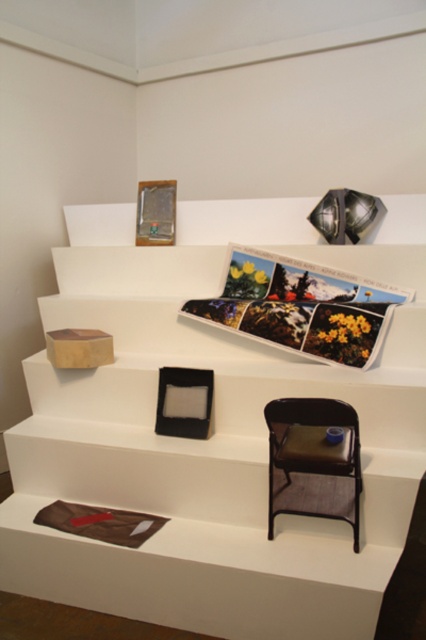
You are organizing a small event and need to place a 10cm tall decorative item on the setup. Considering the wooden box at upper left and the brown leather chair at lower right, which object can support the item without it toppling over?

The wooden box at upper left has a greater height compared to the brown leather chair at lower right, so the decorative item can be placed on the wooden box at upper left as it provides a stable, elevated surface.

You are standing in front of the minimalist display setup. There are two points marked on the image, point (416,483) and point (284,474). Which point is closer to your eyes?

Point (416,483) is closer to the camera than point (284,474), so the point closer to your eyes is point (416,483).